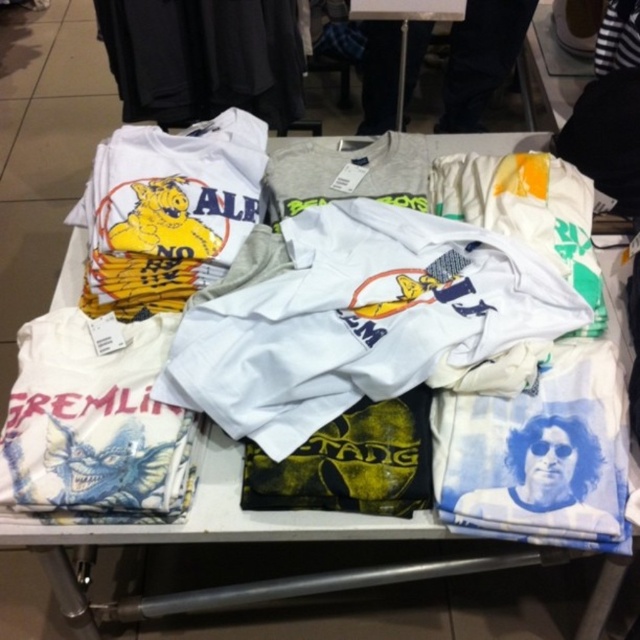
Is yellow matte t-shirt at upper left behind white cotton t-shirt at upper center?

No, yellow matte t-shirt at upper left is closer to the viewer.

Locate an element on the screen. The height and width of the screenshot is (640, 640). yellow matte t-shirt at upper left is located at coordinates (168, 211).

Can you confirm if white cotton t-shirt at center is bigger than white cotton t-shirt at upper center?

Actually, white cotton t-shirt at center might be smaller than white cotton t-shirt at upper center.

The image size is (640, 640). Describe the element at coordinates (358, 320) in the screenshot. I see `white cotton t-shirt at center` at that location.

Which is behind, point (378, 244) or point (480, 60)?

Positioned behind is point (480, 60).

You are a GUI agent. You are given a task and a screenshot of the screen. Output one action in this format:
    pyautogui.click(x=<x>, y=<y>)
    Task: Click on the white cotton t-shirt at center
    
    Given the screenshot: What is the action you would take?
    pyautogui.click(x=358, y=320)

Is white cotton t-shirt at center smaller than yellow matte t-shirt at upper left?

No.

What are the coordinates of `white cotton t-shirt at center` in the screenshot? It's located at (358, 320).

Between point (376, 285) and point (161, 294), which one is positioned behind?

Point (161, 294)

Locate an element on the screen. Image resolution: width=640 pixels, height=640 pixels. white cotton t-shirt at center is located at coordinates (358, 320).